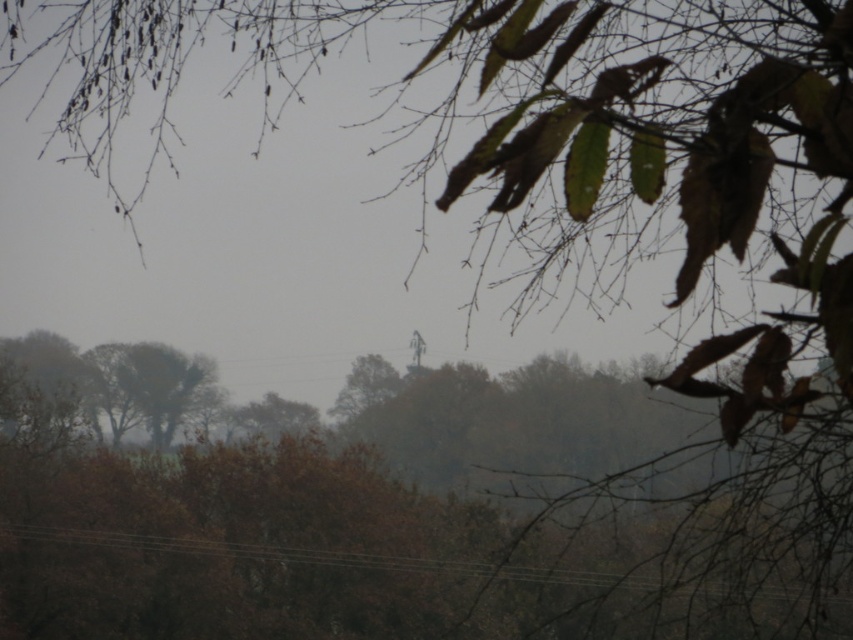
Is point (264, 556) farther from camera compared to point (177, 376)?

No.

Does brown matte power line at lower center come behind brown textured tree at lower left?

No, it is not.

Is point (367, 561) closer to camera compared to point (144, 355)?

Yes.

The height and width of the screenshot is (640, 853). I want to click on brown matte power line at lower center, so click(x=318, y=556).